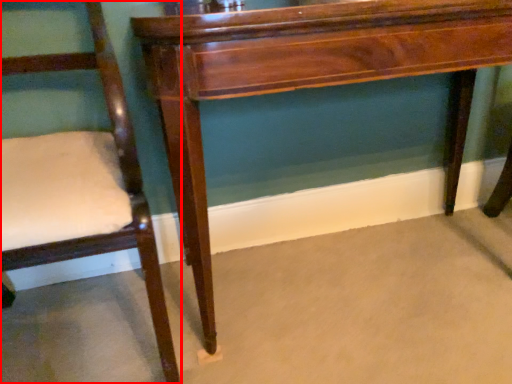
Question: From the image's perspective, where is chair (annotated by the red box) located in relation to table in the image?

Choices:
 (A) below
 (B) above

Answer: (A)